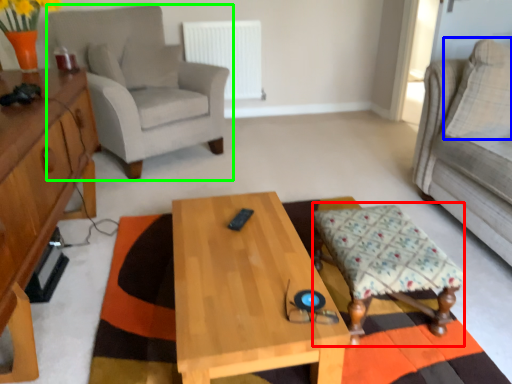
Question: Which is nearer to the stool (highlighted by a red box)? pillow (highlighted by a blue box) or chair (highlighted by a green box).

Choices:
 (A) pillow
 (B) chair

Answer: (A)